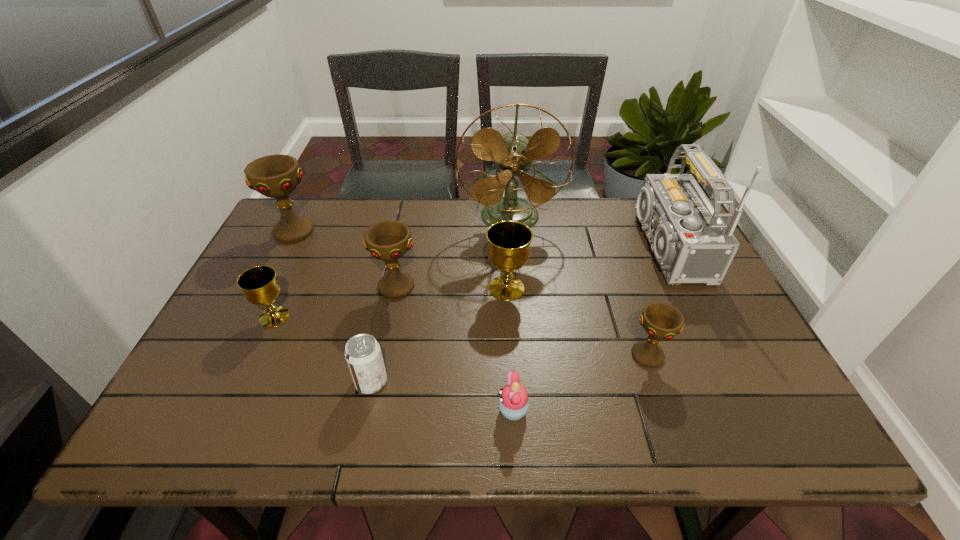
Locate an element on the screen. vacant space situated 0.280m on the front of the right gold chalice is located at coordinates (514, 400).

Find the location of a particular element. The height and width of the screenshot is (540, 960). vacant space situated on the front of the smaller gold chalice is located at coordinates (254, 361).

What are the coordinates of `vacant space located on the back of the rightmost chalice` in the screenshot? It's located at (622, 282).

This screenshot has height=540, width=960. I want to click on free space located on the back of the soda can, so click(389, 298).

At what (x,y) coordinates should I click in order to perform the action: click on free location located 0.270m on the face of the cupcake. Please return your answer as a coordinate pair (x, y). The height and width of the screenshot is (540, 960). Looking at the image, I should click on (368, 410).

You are a GUI agent. You are given a task and a screenshot of the screen. Output one action in this format:
    pyautogui.click(x=<x>, y=<y>)
    Task: Click on the free space located 0.340m on the face of the cupcake
    
    Given the screenshot: What is the action you would take?
    pyautogui.click(x=334, y=410)

Locate an element on the screen. free region located 0.250m on the face of the cupcake is located at coordinates (377, 410).

Image resolution: width=960 pixels, height=540 pixels. What are the coordinates of `fan that is at the far edge` in the screenshot? It's located at (513, 152).

Locate an element on the screen. The width and height of the screenshot is (960, 540). radio receiver at the far edge is located at coordinates (691, 242).

This screenshot has width=960, height=540. I want to click on chalice that is positioned at the far edge, so click(276, 176).